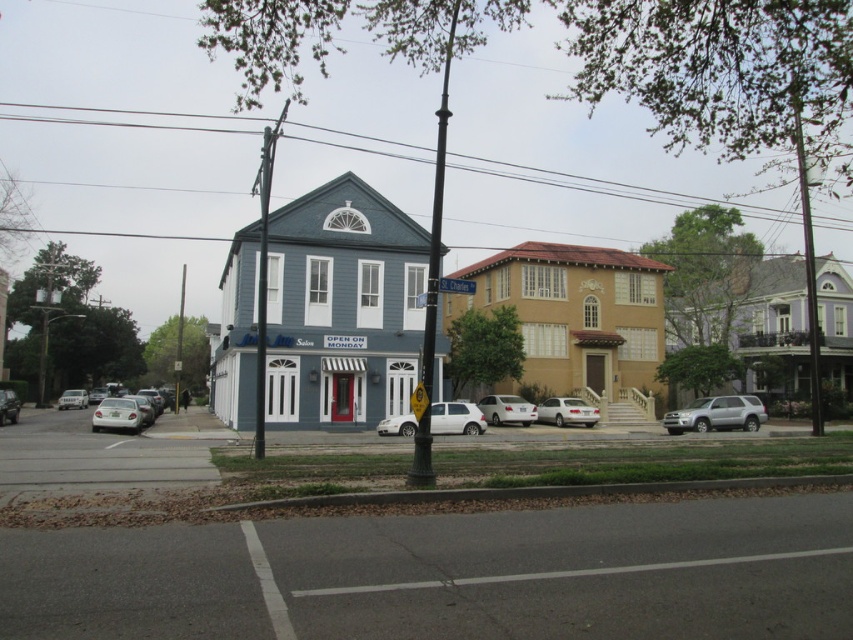
Which is in front, point (112, 410) or point (518, 410)?

Point (112, 410)

Can you confirm if white matte car at lower left is wider than white matte sedan at center?

Indeed, white matte car at lower left has a greater width compared to white matte sedan at center.

Who is more forward, (136, 419) or (511, 420)?

Point (136, 419) is more forward.

Find the location of `white matte car at lower left`. white matte car at lower left is located at coordinates (117, 416).

Between silver metallic sedan at center and white matte car at lower left, which one has more height?

Standing taller between the two is silver metallic sedan at center.

Between silver metallic sedan at center and white matte car at lower left, which one is positioned lower?

silver metallic sedan at center

Locate an element on the screen. The height and width of the screenshot is (640, 853). silver metallic sedan at center is located at coordinates (567, 412).

Between point (109, 426) and point (12, 422), which one is positioned in front?

Positioned in front is point (109, 426).

Locate an element on the screen. The width and height of the screenshot is (853, 640). white matte car at lower left is located at coordinates (117, 416).

The image size is (853, 640). In order to click on white matte car at lower left in this screenshot , I will do `click(117, 416)`.